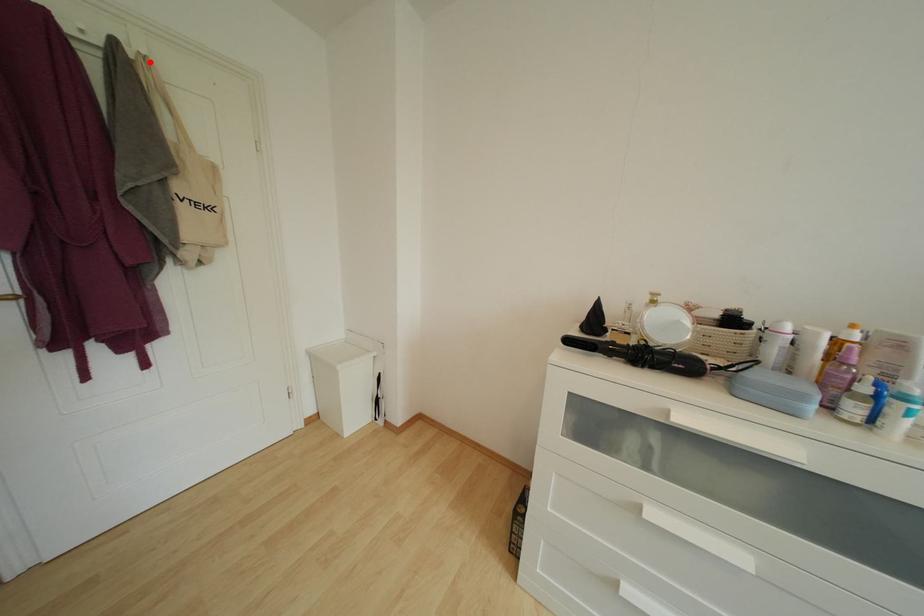
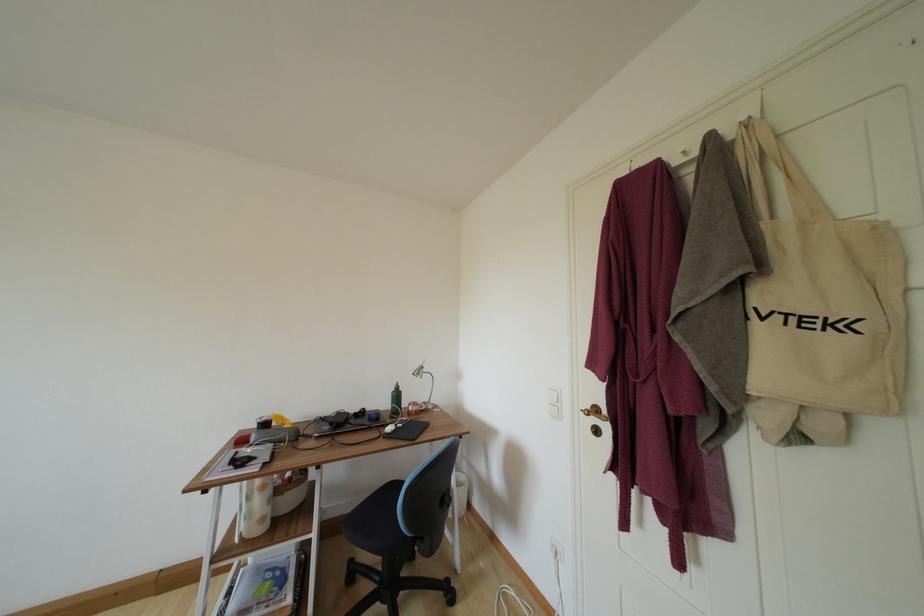
The point at the highlighted location is marked in the first image. Where is the corresponding point in the second image?

(751, 128)